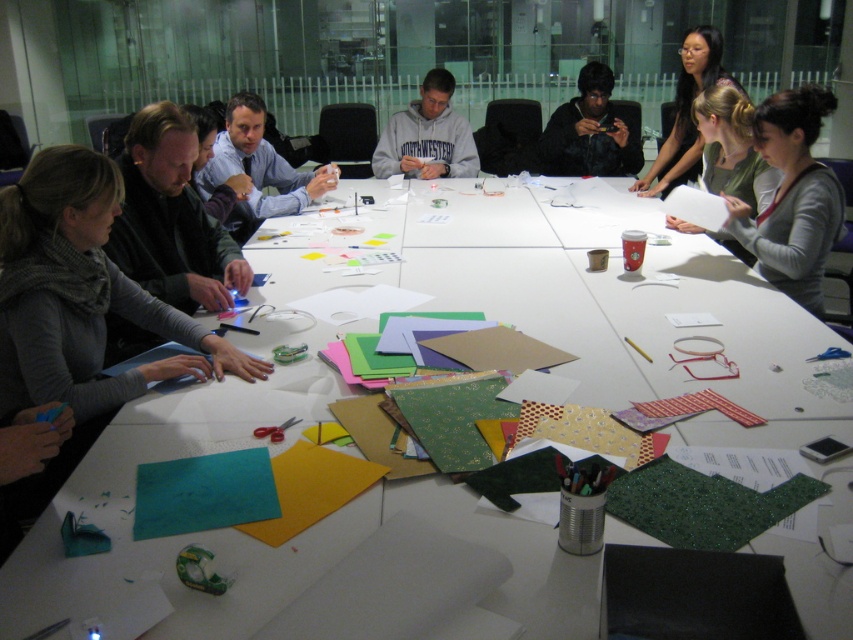
You are standing 10 feet away from the table in the office scene. The matte gray sweater at upper right is on the table. Can you reach it without moving closer than 7 feet?

The matte gray sweater at upper right is 7.73 feet away from the camera. Since you are standing 10 feet away from the table, you would need to move closer to reach it. To stay at least 7 feet away, you are 2.27 feet too far to comfortably reach the sweater without moving closer.

You are an observer in the room and want to determine which clothing item is bigger between the matte gray sweater at upper right and the matte blue shirt at upper center. Based on the scene, which one is larger?

The matte gray sweater at upper right is larger than the matte blue shirt at upper center according to the description.